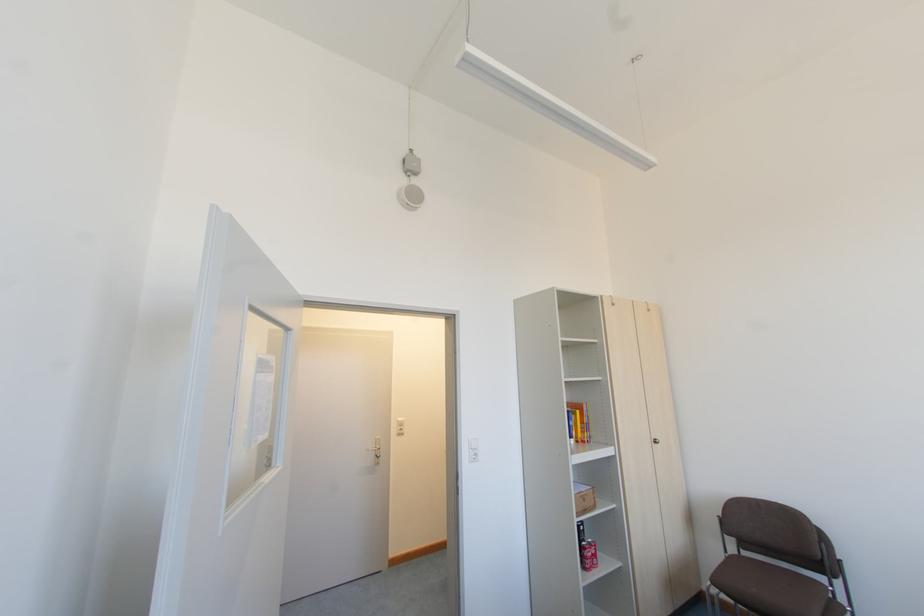
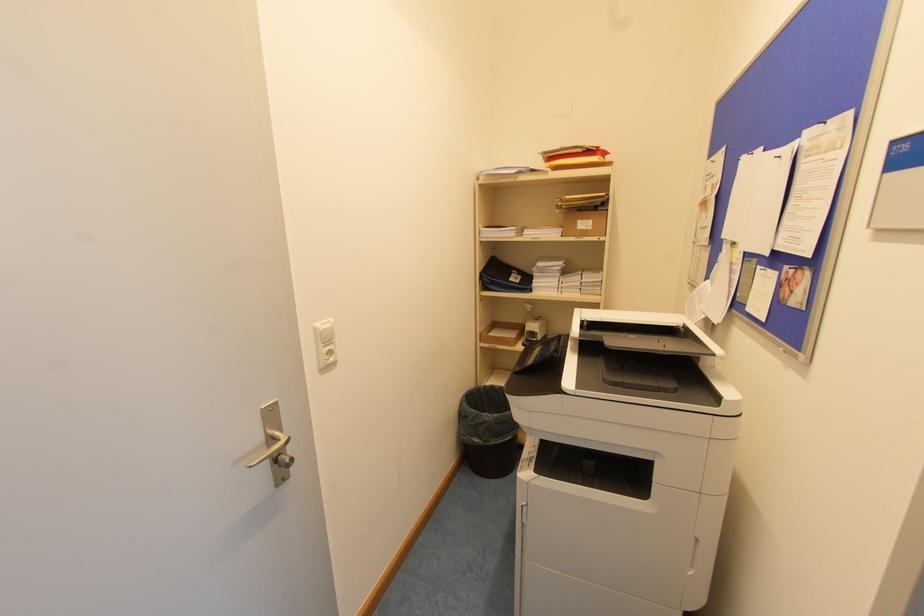
Find the pixel in the second image that matches pixel 400 429 in the first image.

(330, 352)